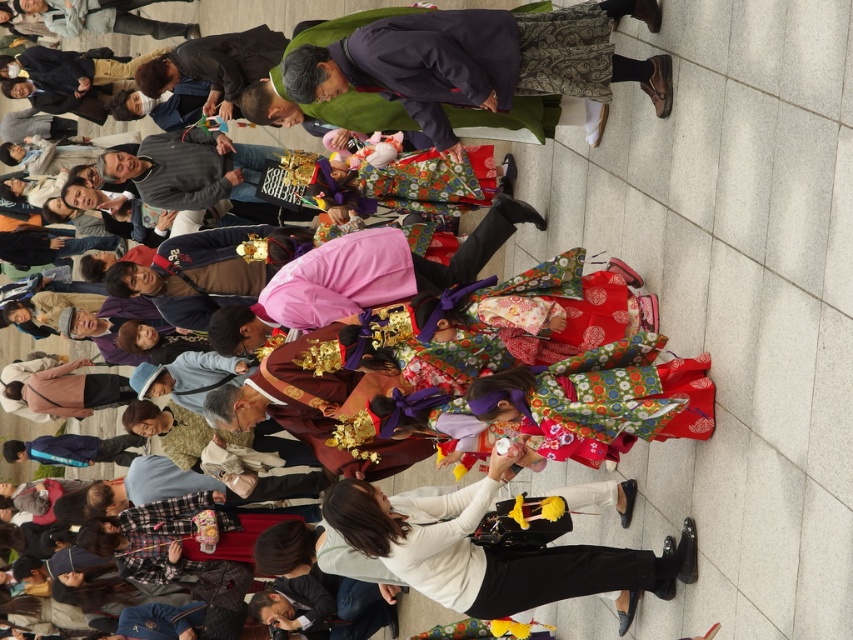
You are a photographer at the festival and need to capture both the white matte pants at center and the pink satin kimono at center in a single frame. Given their sizes, which one might appear more prominent in the photo?

The white matte pants at center is larger in size than the pink satin kimono at center, so it will appear more prominent in the photo.

From the picture: You are a photographer positioned at the back of the crowd in the scene. You want to take a photo of the pink satin kimono at center without the white matte pants at center blocking it. Is this possible?

The white matte pants at center is in front of the pink satin kimono at center, so it will block the view. Therefore, you cannot take a photo of the pink satin kimono at center without the white matte pants at center blocking it.